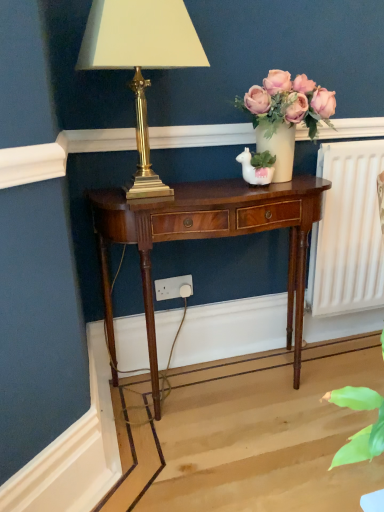
Image resolution: width=384 pixels, height=512 pixels. What do you see at coordinates (141, 61) in the screenshot?
I see `gold brass lamp at upper left` at bounding box center [141, 61].

You are a GUI agent. You are given a task and a screenshot of the screen. Output one action in this format:
    pyautogui.click(x=<x>, y=<y>)
    Task: Click on the gold brass lamp at upper left
    
    Given the screenshot: What is the action you would take?
    pyautogui.click(x=141, y=61)

In order to click on white plastic power outlet at lower center in this screenshot , I will do `click(174, 287)`.

Is mahogany wood nightstand at center with matte white vase at upper right?

No, mahogany wood nightstand at center is not touching matte white vase at upper right.

Considering the positions of objects mahogany wood nightstand at center and matte white vase at upper right in the image provided, who is behind, mahogany wood nightstand at center or matte white vase at upper right?

matte white vase at upper right is further from the camera.

Is mahogany wood nightstand at center thinner than matte white vase at upper right?

Incorrect, the width of mahogany wood nightstand at center is not less than that of matte white vase at upper right.

Would you say mahogany wood nightstand at center is outside white plastic power outlet at lower center?

Yes, mahogany wood nightstand at center is located beyond the bounds of white plastic power outlet at lower center.

In the scene shown: Considering the sizes of objects mahogany wood nightstand at center and white plastic power outlet at lower center in the image provided, who is smaller, mahogany wood nightstand at center or white plastic power outlet at lower center?

white plastic power outlet at lower center.

Looking at this image, is mahogany wood nightstand at center facing towards white plastic power outlet at lower center?

Yes, mahogany wood nightstand at center is turned towards white plastic power outlet at lower center.

Between point (129, 222) and point (180, 280), which one is positioned in front?

Positioned in front is point (129, 222).

Which of these two, white plastic power outlet at lower center or gold brass lamp at upper left, is bigger?

With larger size is gold brass lamp at upper left.

From a real-world perspective, who is located higher, white plastic power outlet at lower center or gold brass lamp at upper left?

gold brass lamp at upper left.

Which object is positioned more to the right, white plastic power outlet at lower center or gold brass lamp at upper left?

white plastic power outlet at lower center.

Is white plastic power outlet at lower center aimed at matte white vase at upper right?

No, white plastic power outlet at lower center does not turn towards matte white vase at upper right.

Which is correct: white plastic power outlet at lower center is inside matte white vase at upper right, or outside of it?

white plastic power outlet at lower center is outside matte white vase at upper right.

Are white plastic power outlet at lower center and matte white vase at upper right located far from each other?

Actually, white plastic power outlet at lower center and matte white vase at upper right are a little close together.

From the picture: How different are the orientations of white plastic power outlet at lower center and matte white vase at upper right in degrees?

white plastic power outlet at lower center and matte white vase at upper right are facing 3.89 degrees away from each other.

Based on the photo, does gold brass lamp at upper left appear on the right side of white plastic power outlet at lower center?

No, gold brass lamp at upper left is not to the right of white plastic power outlet at lower center.

Is gold brass lamp at upper left facing away from white plastic power outlet at lower center?

gold brass lamp at upper left does not have its back to white plastic power outlet at lower center.

In the scene shown: Is gold brass lamp at upper left closer to camera compared to white plastic power outlet at lower center?

Yes.

Which is less distant, (108,63) or (191,284)?

Point (108,63) appears to be closer to the viewer than point (191,284).

Is gold brass lamp at upper left located outside matte white vase at upper right?

Yes, gold brass lamp at upper left is not within matte white vase at upper right.

Does gold brass lamp at upper left appear on the right side of matte white vase at upper right?

No.

From a real-world perspective, is gold brass lamp at upper left below matte white vase at upper right?

No, from a real-world perspective, gold brass lamp at upper left is not below matte white vase at upper right.

How many degrees apart are the facing directions of matte white vase at upper right and mahogany wood nightstand at center?

There is a 3.6-degree angle between the facing directions of matte white vase at upper right and mahogany wood nightstand at center.

Can you confirm if matte white vase at upper right is taller than mahogany wood nightstand at center?

In fact, matte white vase at upper right may be shorter than mahogany wood nightstand at center.

Visually, is matte white vase at upper right positioned to the left or to the right of mahogany wood nightstand at center?

In the image, matte white vase at upper right appears on the right side of mahogany wood nightstand at center.

Find the location of a particular element. The image size is (384, 512). nightstand on the left of matte white vase at upper right is located at coordinates (206, 238).

Identify the location of nightstand above the white plastic power outlet at lower center (from the image's perspective). The image size is (384, 512). (206, 238).

Considering their positions, is mahogany wood nightstand at center positioned closer to white plastic power outlet at lower center than matte white vase at upper right?

mahogany wood nightstand at center.

From the image, which object appears to be nearer to matte white vase at upper right, gold brass lamp at upper left or mahogany wood nightstand at center?

Based on the image, mahogany wood nightstand at center appears to be nearer to matte white vase at upper right.

Looking at the image, which one is located further to matte white vase at upper right, gold brass lamp at upper left or white plastic power outlet at lower center?

Among the two, white plastic power outlet at lower center is located further to matte white vase at upper right.

Which object lies nearer to the anchor point gold brass lamp at upper left, mahogany wood nightstand at center or white plastic power outlet at lower center?

mahogany wood nightstand at center is closer to gold brass lamp at upper left.

Based on their spatial positions, is matte white vase at upper right or gold brass lamp at upper left closer to mahogany wood nightstand at center?

matte white vase at upper right is positioned closer to the anchor mahogany wood nightstand at center.

Looking at the image, which one is located closer to matte white vase at upper right, white plastic power outlet at lower center or mahogany wood nightstand at center?

Based on the image, mahogany wood nightstand at center appears to be nearer to matte white vase at upper right.

Considering their positions, is white plastic power outlet at lower center positioned further to gold brass lamp at upper left than matte white vase at upper right?

The object further to gold brass lamp at upper left is white plastic power outlet at lower center.

When comparing their distances from white plastic power outlet at lower center, does mahogany wood nightstand at center or gold brass lamp at upper left seem further?

gold brass lamp at upper left lies further to white plastic power outlet at lower center than the other object.

Locate an element on the screen. This screenshot has width=384, height=512. houseplant between gold brass lamp at upper left and white plastic power outlet at lower center from front to back is located at coordinates (285, 115).

At what (x,y) coordinates should I click in order to perform the action: click on nightstand that lies between matte white vase at upper right and white plastic power outlet at lower center from top to bottom. Please return your answer as a coordinate pair (x, y). The image size is (384, 512). Looking at the image, I should click on (206, 238).

The height and width of the screenshot is (512, 384). Find the location of `nightstand located between gold brass lamp at upper left and white plastic power outlet at lower center in the depth direction`. nightstand located between gold brass lamp at upper left and white plastic power outlet at lower center in the depth direction is located at coordinates (206, 238).

I want to click on houseplant between gold brass lamp at upper left and mahogany wood nightstand at center vertically, so click(x=285, y=115).